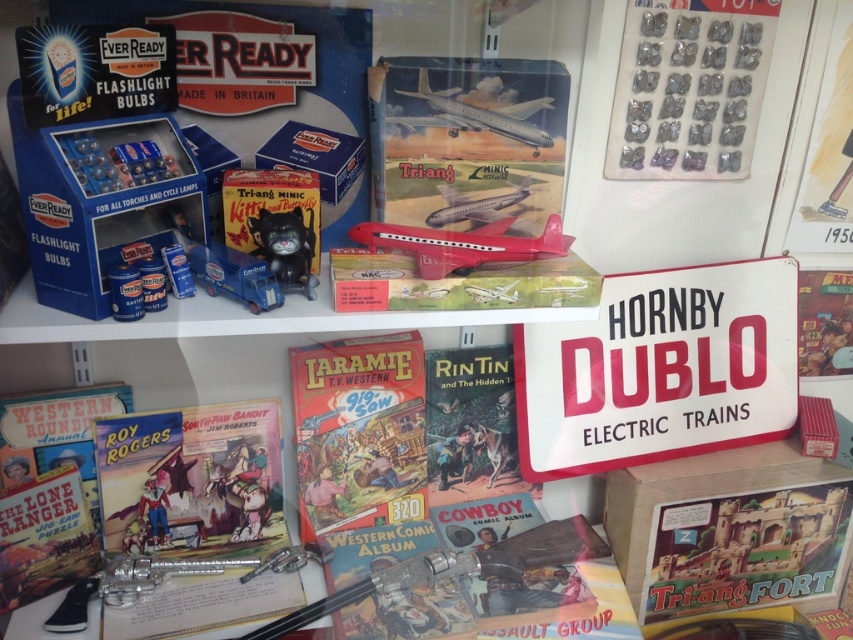
Does matte red airplane at center have a lesser height compared to blue metallic truck at center?

In fact, matte red airplane at center may be taller than blue metallic truck at center.

Between matte red airplane at center and blue metallic truck at center, which one is positioned lower?

Positioned lower is blue metallic truck at center.

What do you see at coordinates (462, 244) in the screenshot? I see `matte red airplane at center` at bounding box center [462, 244].

You are a GUI agent. You are given a task and a screenshot of the screen. Output one action in this format:
    pyautogui.click(x=<x>, y=<y>)
    Task: Click on the matte red airplane at center
    
    Given the screenshot: What is the action you would take?
    pyautogui.click(x=462, y=244)

Can you confirm if hardcover comic book at center is taller than blue metallic truck at center?

Correct, hardcover comic book at center is much taller as blue metallic truck at center.

Is point (422, 444) more distant than point (248, 272)?

Yes, it is behind point (248, 272).

Who is more distant from viewer, (370, 368) or (247, 257)?

Point (370, 368)

Image resolution: width=853 pixels, height=640 pixels. Find the location of `hardcover comic book at center`. hardcover comic book at center is located at coordinates (357, 426).

Is matte red airplane at center positioned at the back of metallic airplane at upper center?

That is False.

Does matte red airplane at center have a greater height compared to metallic airplane at upper center?

Correct, matte red airplane at center is much taller as metallic airplane at upper center.

What do you see at coordinates (462, 244) in the screenshot?
I see `matte red airplane at center` at bounding box center [462, 244].

Where is `matte red airplane at center`? Image resolution: width=853 pixels, height=640 pixels. matte red airplane at center is located at coordinates [462, 244].